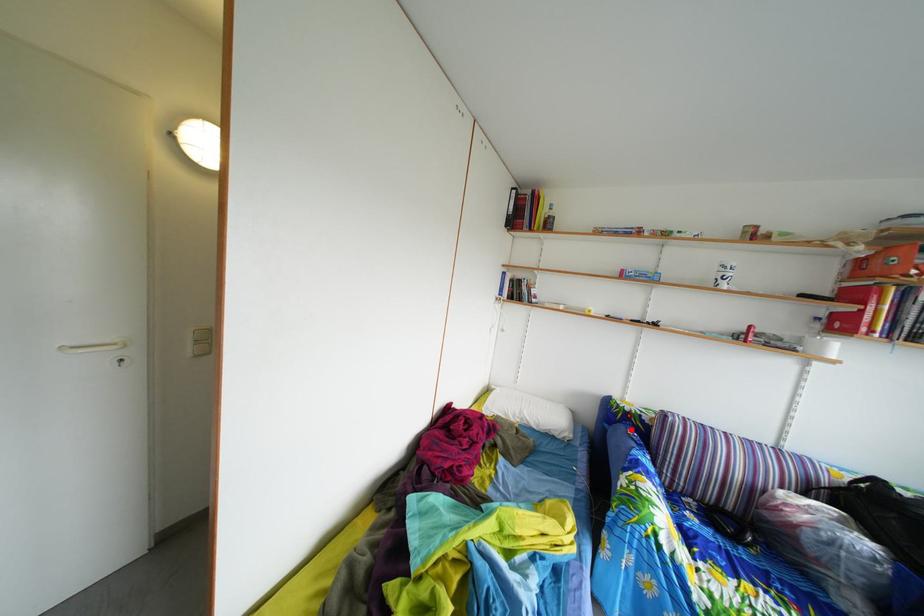
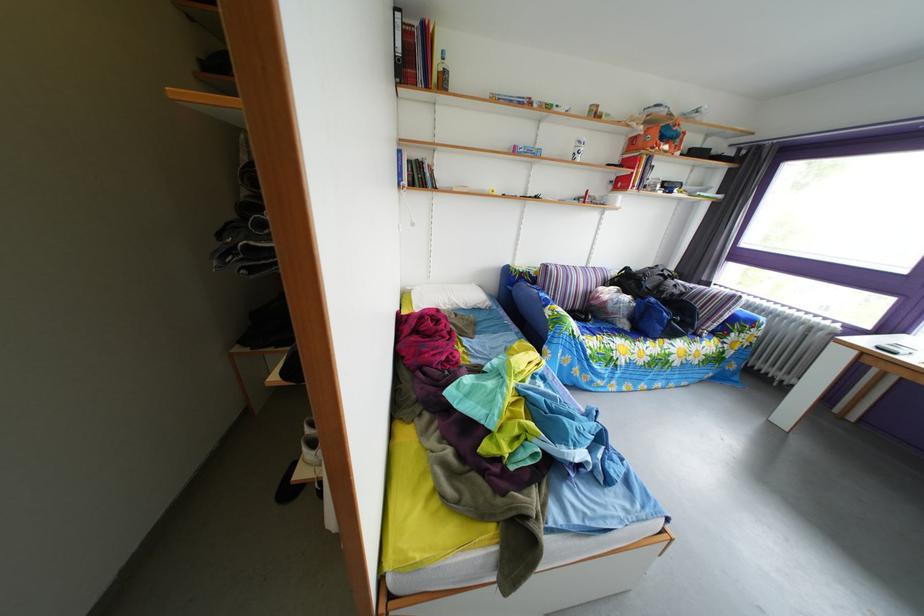
Question: I am providing you with two images of the same scene from different viewpoints. A red point is marked on the first image. Is the red point's position out of view in image 2?

Choices:
 (A) Yes
 (B) No

Answer: (B)